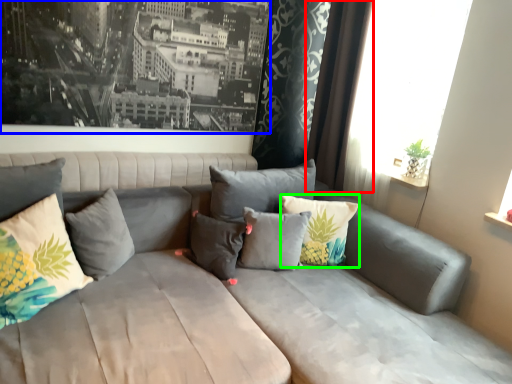
Question: Which is farther away from curtain (highlighted by a red box)? picture frame (highlighted by a blue box) or pillow (highlighted by a green box)?

Choices:
 (A) picture frame
 (B) pillow

Answer: (A)